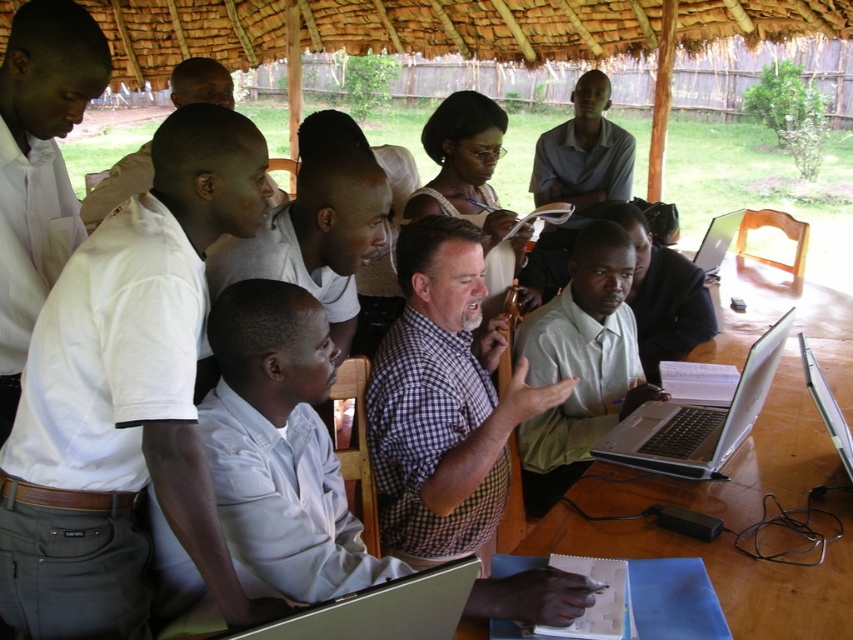
Question: Does white shirt at left have a greater width compared to white shirt at upper left?

Choices:
 (A) no
 (B) yes

Answer: (A)

Question: Among these objects, which one is farthest from the camera?

Choices:
 (A) light green shirt at center
 (B) white shirt at left

Answer: (A)

Question: Considering the real-world distances, which object is farthest from the silver/black plastic laptop at lower center?

Choices:
 (A) wooden table at center
 (B) light brown shirt at center

Answer: (B)

Question: Does wooden table at center appear over white shirt at upper left?

Choices:
 (A) no
 (B) yes

Answer: (A)

Question: Considering the real-world distances, which object is closest to the silver/black plastic laptop at lower center?

Choices:
 (A) silver metallic laptop at lower center
 (B) silver metallic laptop at upper right
 (C) light brown shirt at center

Answer: (A)

Question: Does white cotton shirt at left have a smaller size compared to green matte shirt at center?

Choices:
 (A) no
 (B) yes

Answer: (A)